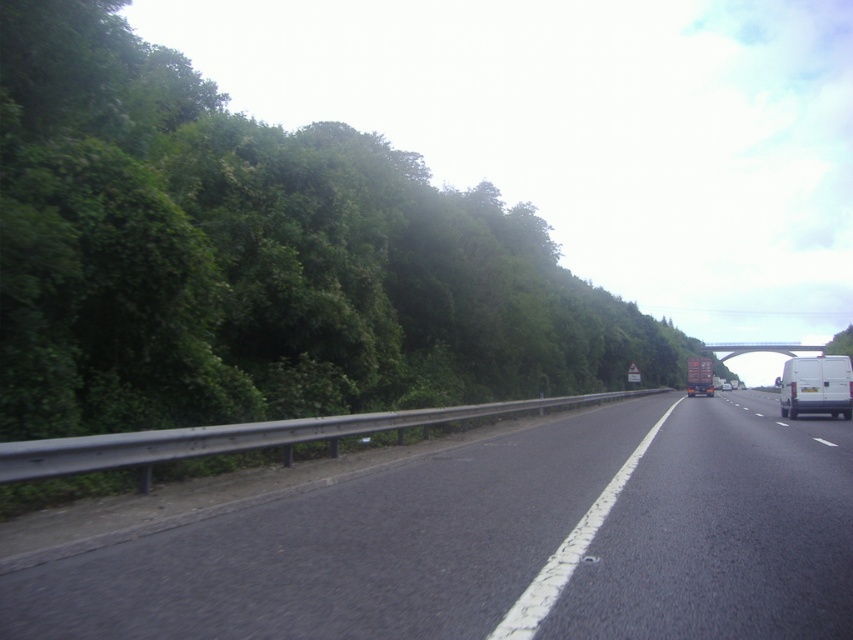
Question: From the image, what is the correct spatial relationship of green leafy trees at left in relation to metallic brown trailer truck at center?

Choices:
 (A) left
 (B) right

Answer: (A)

Question: Which is nearer to the green leafy tree at upper right?

Choices:
 (A) metallic brown trailer truck at center
 (B) white matte van at right

Answer: (B)

Question: Does metallic brown trailer truck at center have a lesser width compared to green leafy tree at upper right?

Choices:
 (A) no
 (B) yes

Answer: (B)

Question: Which object is closer to the camera taking this photo?

Choices:
 (A) green leafy tree at upper right
 (B) asphalt road at center

Answer: (B)

Question: Observing the image, what is the correct spatial positioning of green leafy trees at left in reference to white matte van at right?

Choices:
 (A) left
 (B) right

Answer: (A)

Question: Which object is the farthest from the green leafy trees at left?

Choices:
 (A) green leafy tree at upper right
 (B) asphalt road at center
 (C) metallic brown trailer truck at center

Answer: (A)